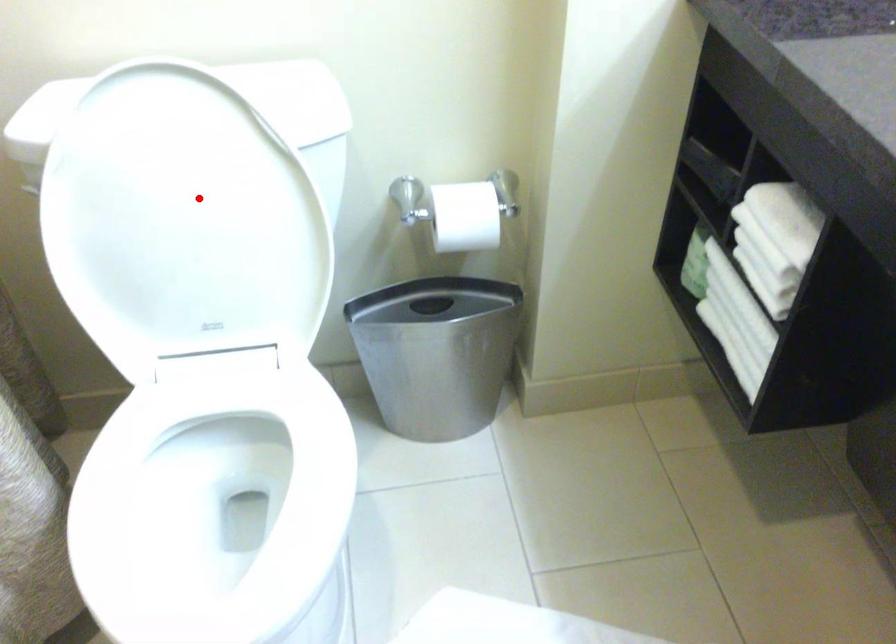
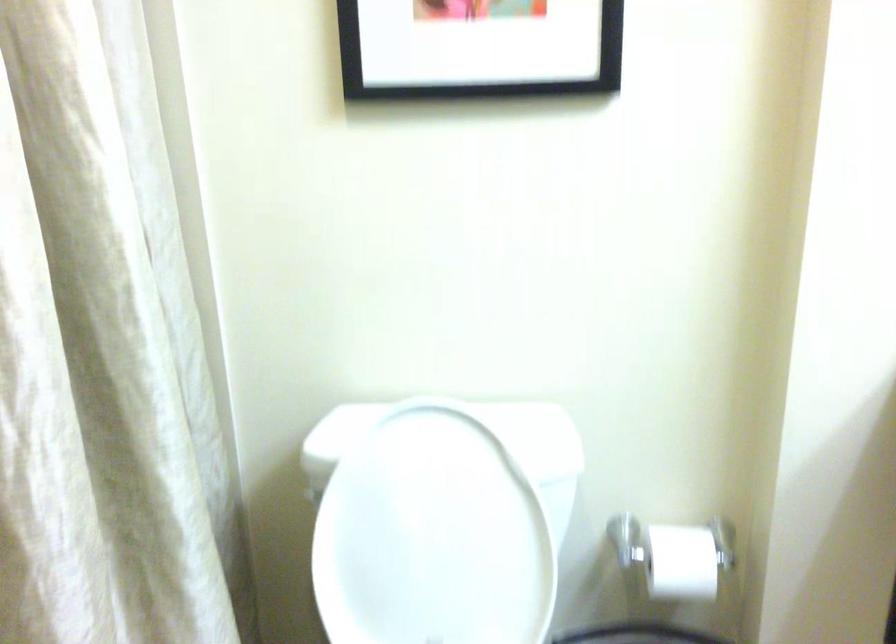
Question: I am providing you with two images of the same scene from different viewpoints. Given a red point in image1, look at the same physical point in image2. Is it:

Choices:
 (A) Closer to the viewpoint
 (B) Farther from the viewpoint

Answer: (B)